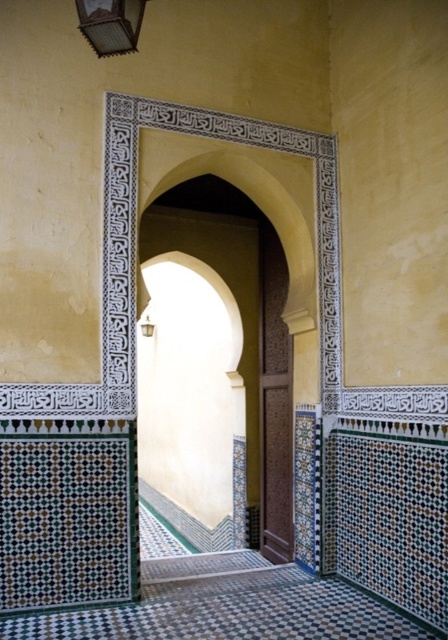
Who is lower down, brown carved wood door at center or metallic glass at upper left?

Positioned lower is brown carved wood door at center.

Measure the distance between brown carved wood door at center and metallic glass at upper left.

brown carved wood door at center is 12.70 feet from metallic glass at upper left.

Is point (271, 248) positioned behind point (103, 42)?

Yes, point (271, 248) is behind point (103, 42).

At what (x,y) coordinates should I click in order to perform the action: click on brown carved wood door at center. Please return your answer as a coordinate pair (x, y). The image size is (448, 640). Looking at the image, I should click on point(275,401).